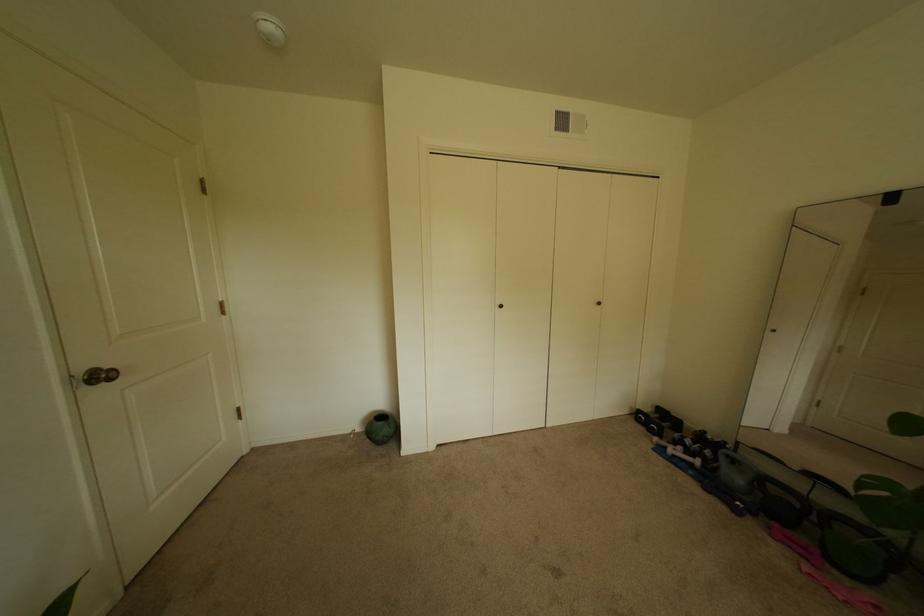
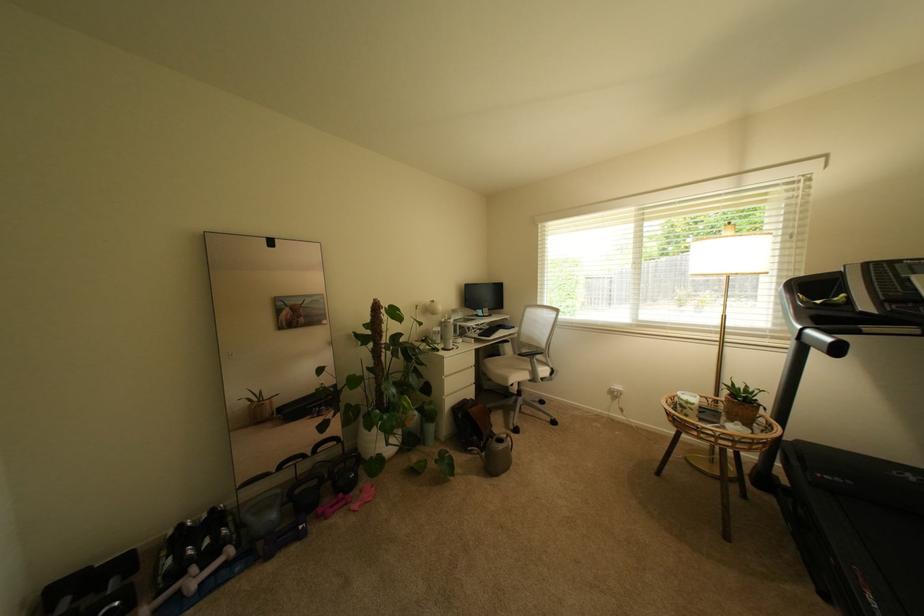
Where in the second image is the point corresponding to point 844,573 from the first image?

(359, 495)